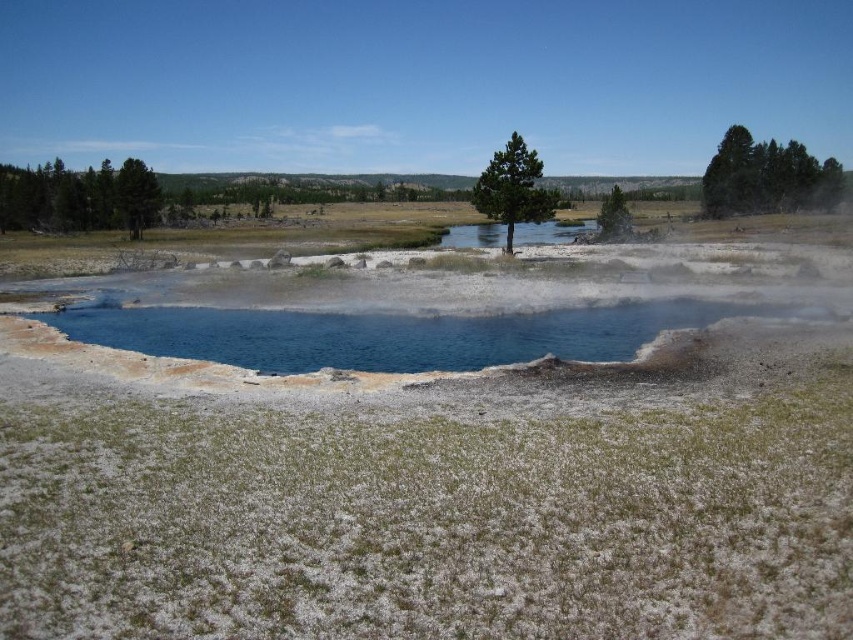
Is point (16, 225) positioned before point (827, 164)?

Yes, it is.

Where is `green textured tree at left`? The height and width of the screenshot is (640, 853). green textured tree at left is located at coordinates (78, 196).

I want to click on green textured tree at left, so click(x=78, y=196).

Who is positioned more to the right, blue water at center or green textured tree at left?

blue water at center is more to the right.

Is blue water at center below green textured tree at left?

Yes, blue water at center is below green textured tree at left.

Does point (351, 332) come behind point (1, 221)?

No.

You are a GUI agent. You are given a task and a screenshot of the screen. Output one action in this format:
    pyautogui.click(x=<x>, y=<y>)
    Task: Click on the blue water at center
    The image size is (853, 640).
    Given the screenshot: What is the action you would take?
    pyautogui.click(x=445, y=308)

Does green matte tree at left appear under green leafy tree at upper center?

Yes, green matte tree at left is below green leafy tree at upper center.

Is green matte tree at left closer to camera compared to green leafy tree at upper center?

No, it is behind green leafy tree at upper center.

Between point (128, 225) and point (602, 230), which one is positioned in front?

Point (602, 230)

What are the coordinates of `green matte tree at left` in the screenshot? It's located at (136, 195).